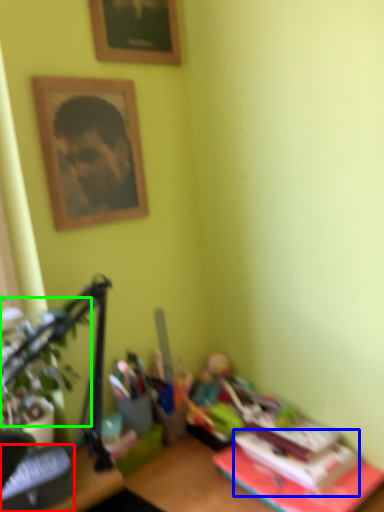
Question: Which object is positioned closest to paperback book (highlighted by a red box)? Select from paperback book (highlighted by a blue box) and plant (highlighted by a green box).

Choices:
 (A) paperback book
 (B) plant

Answer: (B)